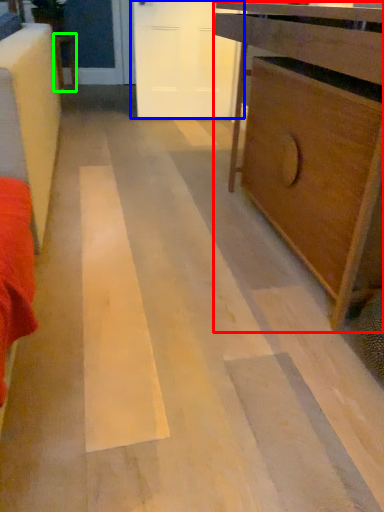
Question: Which object is the closest to the chest of drawers (highlighted by a red box)? Choose among these: door (highlighted by a blue box) or furniture (highlighted by a green box).

Choices:
 (A) door
 (B) furniture

Answer: (A)